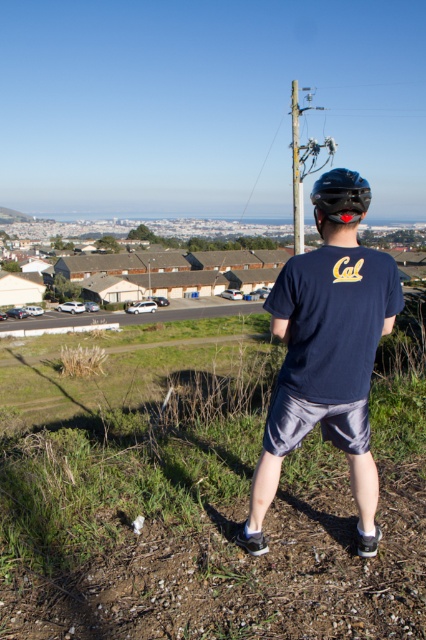
Does brown dirt track at lower center have a larger size compared to navy blue t-shirt at center?

Indeed, brown dirt track at lower center has a larger size compared to navy blue t-shirt at center.

Is brown dirt track at lower center shorter than navy blue t-shirt at center?

Yes, brown dirt track at lower center is shorter than navy blue t-shirt at center.

Between point (396, 500) and point (340, 205), which one is positioned behind?

The point (396, 500) is behind.

The image size is (426, 640). I want to click on brown dirt track at lower center, so click(236, 572).

Can you confirm if brown dirt track at lower center is taller than black matte helmet at center?

No, brown dirt track at lower center is not taller than black matte helmet at center.

Does brown dirt track at lower center have a lesser height compared to black matte helmet at center?

Yes.

I want to click on brown dirt track at lower center, so click(x=236, y=572).

Does navy blue t-shirt at center have a lesser width compared to black matte helmet at center?

Correct, navy blue t-shirt at center's width is less than black matte helmet at center's.

What do you see at coordinates (328, 352) in the screenshot? The height and width of the screenshot is (640, 426). I see `navy blue t-shirt at center` at bounding box center [328, 352].

This screenshot has height=640, width=426. I want to click on navy blue t-shirt at center, so click(x=328, y=352).